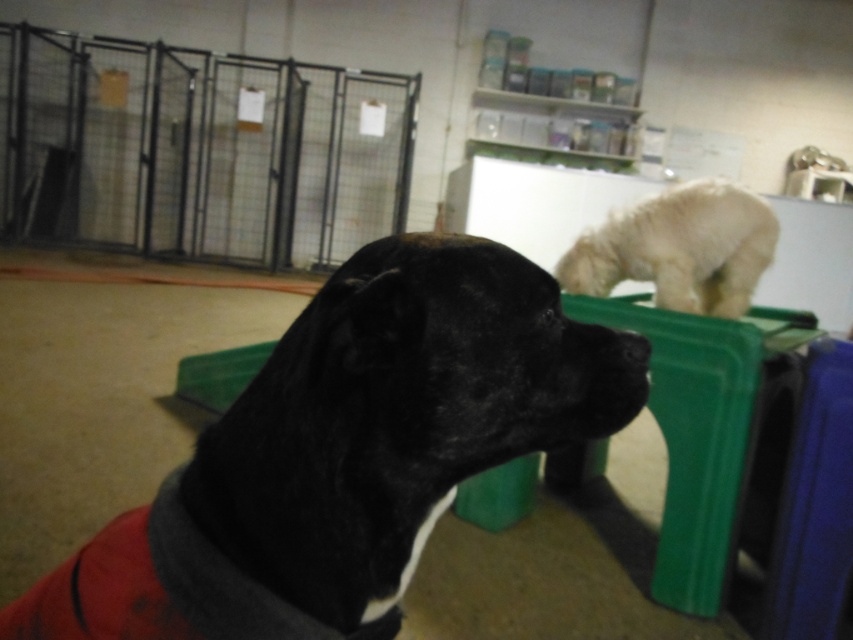
Question: Which object appears closest to the camera in this image?

Choices:
 (A) black fur dog at center
 (B) white fluffy dog at upper center

Answer: (A)

Question: Is black fur dog at center above white fluffy dog at upper center?

Choices:
 (A) yes
 (B) no

Answer: (B)

Question: Can you confirm if black fur dog at center is bigger than white fluffy dog at upper center?

Choices:
 (A) no
 (B) yes

Answer: (A)

Question: Does black fur dog at center appear on the left side of white fluffy dog at upper center?

Choices:
 (A) no
 (B) yes

Answer: (B)

Question: Among these objects, which one is farthest from the camera?

Choices:
 (A) white fluffy dog at upper center
 (B) black fur dog at center

Answer: (A)